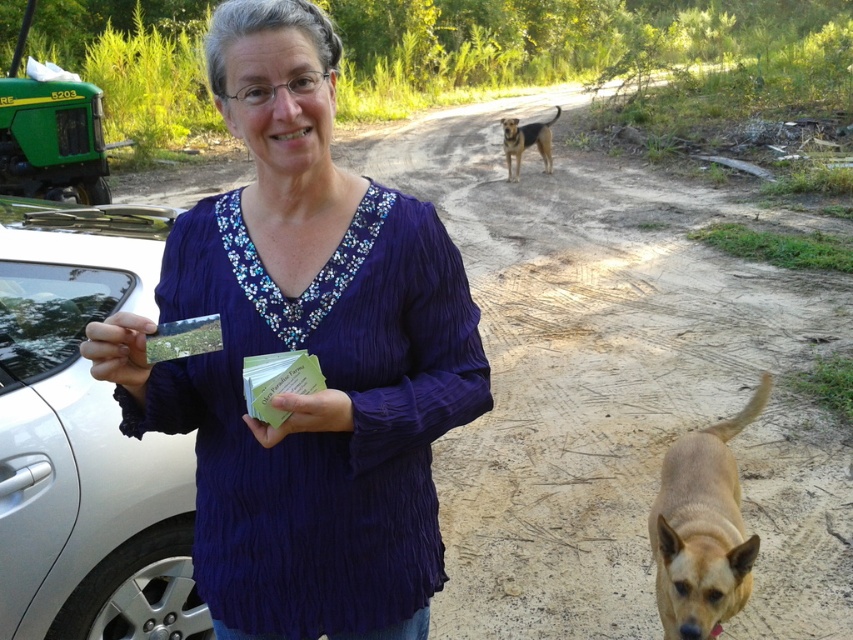
Can you confirm if light brown fur at center is positioned below brown-furred dog at center?

Yes.

Is light brown fur at center bigger than brown-furred dog at center?

No, light brown fur at center is not bigger than brown-furred dog at center.

Does point (701, 589) lie in front of point (506, 132)?

Yes, it is.

You are a GUI agent. You are given a task and a screenshot of the screen. Output one action in this format:
    pyautogui.click(x=<x>, y=<y>)
    Task: Click on the light brown fur at center
    This screenshot has width=853, height=640.
    Given the screenshot: What is the action you would take?
    pyautogui.click(x=701, y=529)

Does purple crinkled shirt at center have a greater width compared to light brown fur at center?

No, purple crinkled shirt at center is not wider than light brown fur at center.

Can you confirm if purple crinkled shirt at center is positioned below light brown fur at center?

Actually, purple crinkled shirt at center is above light brown fur at center.

Who is more distant from viewer, (318, 486) or (692, 614)?

Point (692, 614)

Where is `purple crinkled shirt at center`? purple crinkled shirt at center is located at coordinates (312, 353).

Does matte plastic card at lower left have a lesser height compared to green paper at center?

No, matte plastic card at lower left is not shorter than green paper at center.

Who is more forward, (131,332) or (349,419)?

Point (131,332)

Identify the location of matte plastic card at lower left. This screenshot has width=853, height=640. (119, 349).